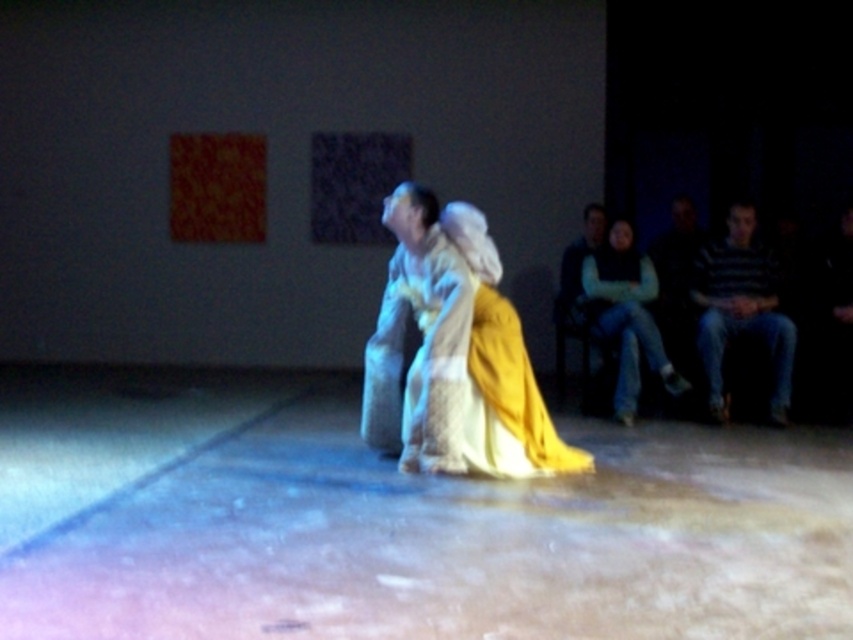
Question: Which object is positioned farthest from the striped sweater at right?

Choices:
 (A) matte white dress at center
 (B) light green sweater at right

Answer: (A)

Question: Is striped sweater at right further to the viewer compared to light green sweater at right?

Choices:
 (A) no
 (B) yes

Answer: (A)

Question: Is matte white dress at center to the left of light green sweater at right from the viewer's perspective?

Choices:
 (A) no
 (B) yes

Answer: (B)

Question: Is matte white dress at center behind light green sweater at right?

Choices:
 (A) yes
 (B) no

Answer: (B)

Question: Estimate the real-world distances between objects in this image. Which object is closer to the striped sweater at right?

Choices:
 (A) light green sweater at right
 (B) matte white dress at center

Answer: (A)

Question: Which is nearer to the striped sweater at right?

Choices:
 (A) matte white dress at center
 (B) light green sweater at right

Answer: (B)